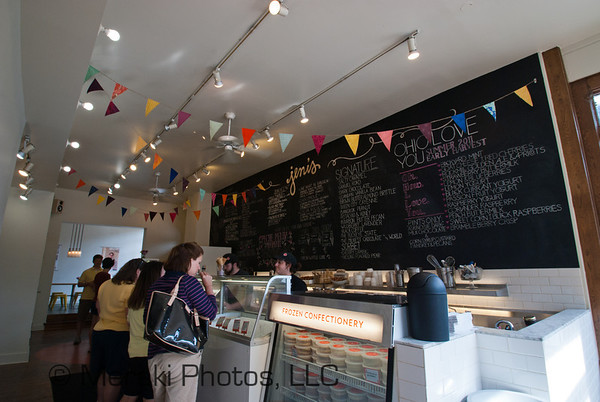
Identify the location of ceiling. This screenshot has height=402, width=600. (341, 25).